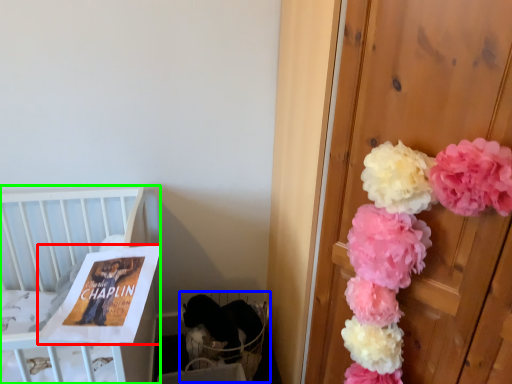
Question: Estimate the real-world distances between objects in this image. Which object is farther from magazine (highlighted by a red box), baby carriage (highlighted by a blue box) or furniture (highlighted by a green box)?

Choices:
 (A) baby carriage
 (B) furniture

Answer: (A)